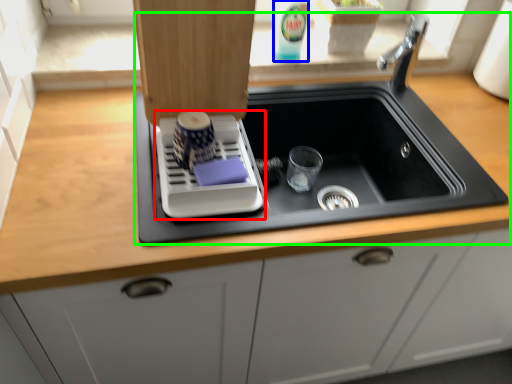
Question: Estimate the real-world distances between objects in this image. Which object is closer to appliance (highlighted by a red box), beverage (highlighted by a blue box) or sink (highlighted by a green box)?

Choices:
 (A) beverage
 (B) sink

Answer: (B)